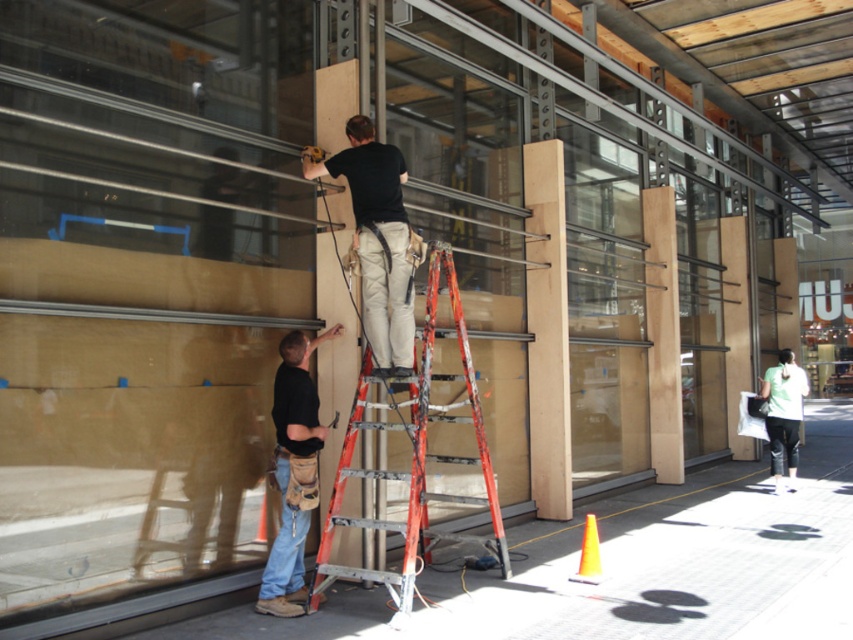
Question: Estimate the real-world distances between objects in this image. Which object is farther from the denim jeans at lower left?

Choices:
 (A) green fabric shirt at lower right
 (B) black matte harness at center
 (C) orange metallic ladder at center

Answer: (A)

Question: Which of the following is the farthest from the observer?

Choices:
 (A) (798, 410)
 (B) (368, 314)

Answer: (A)

Question: Is black matte harness at center thinner than green fabric shirt at lower right?

Choices:
 (A) yes
 (B) no

Answer: (B)

Question: Can you confirm if orange metallic ladder at center is positioned to the right of green fabric shirt at lower right?

Choices:
 (A) no
 (B) yes

Answer: (A)

Question: Can you confirm if orange metallic ladder at center is bigger than green fabric shirt at lower right?

Choices:
 (A) yes
 (B) no

Answer: (A)

Question: Which object is positioned farthest from the orange metallic ladder at center?

Choices:
 (A) green fabric shirt at lower right
 (B) black matte harness at center

Answer: (A)